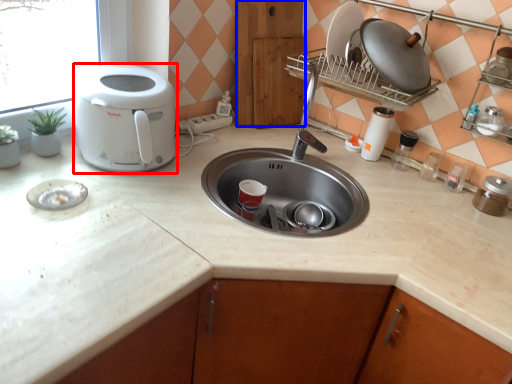
Question: Which of the following is the farthest to the observer, home appliance (highlighted by a red box) or cabinetry (highlighted by a blue box)?

Choices:
 (A) home appliance
 (B) cabinetry

Answer: (B)